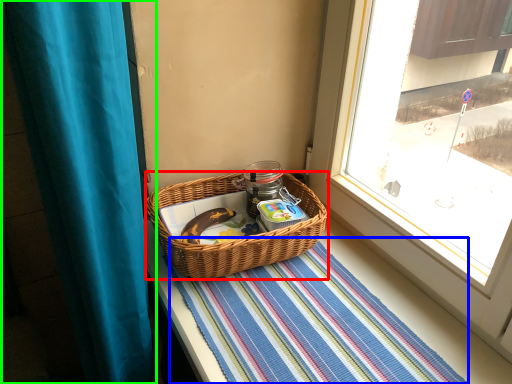
Question: Which object is positioned closest to picnic basket (highlighted by a red box)? Select from mat (highlighted by a blue box) and curtain (highlighted by a green box).

Choices:
 (A) mat
 (B) curtain

Answer: (A)